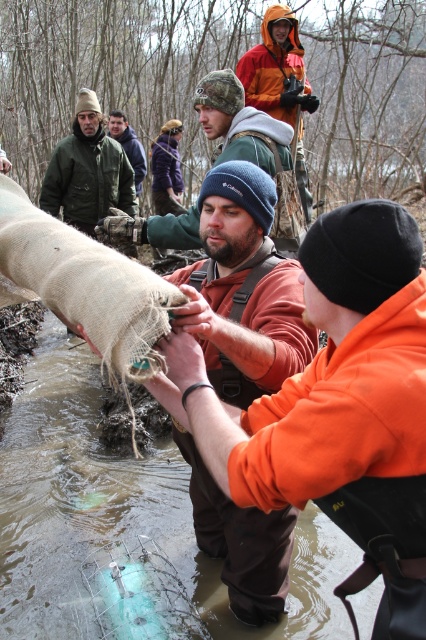
Question: Among these points, which one is nearest to the camera?

Choices:
 (A) (135, 154)
 (B) (227, 70)

Answer: (B)

Question: Does orange fleece jacket at center appear under matte brown bag at center?

Choices:
 (A) no
 (B) yes

Answer: (B)

Question: Is orange fleece jacket at center thinner than green woolen hat at upper center?

Choices:
 (A) no
 (B) yes

Answer: (B)

Question: Which of the following is the closest to the observer?

Choices:
 (A) matte brown jacket at upper left
 (B) green woolen hat at upper center
 (C) orange fleece jacket at center

Answer: (C)

Question: Which object appears farthest from the camera in this image?

Choices:
 (A) orange fleece jacket at center
 (B) matte brown bag at center
 (C) matte brown jacket at center
 (D) green woolen hat at upper center

Answer: (D)

Question: Does orange fleece jacket at center appear on the right side of matte brown bag at center?

Choices:
 (A) yes
 (B) no

Answer: (A)